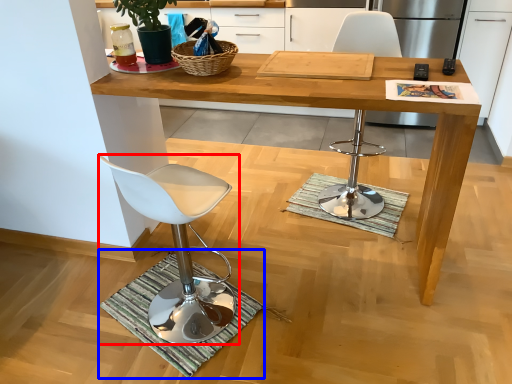
Question: Which object is closer to the camera taking this photo, chair (highlighted by a red box) or doormat (highlighted by a blue box)?

Choices:
 (A) chair
 (B) doormat

Answer: (A)